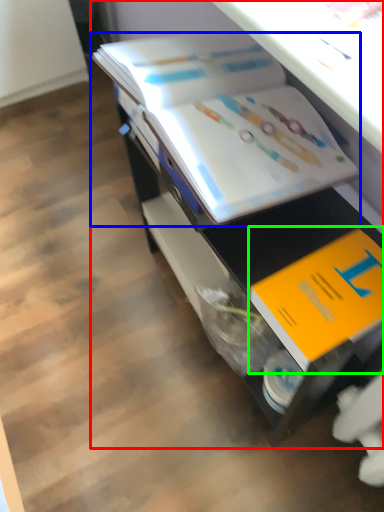
Question: Which object is positioned closest to desk (highlighted by a red box)? Select from book (highlighted by a blue box) and book (highlighted by a green box).

Choices:
 (A) book
 (B) book

Answer: (A)